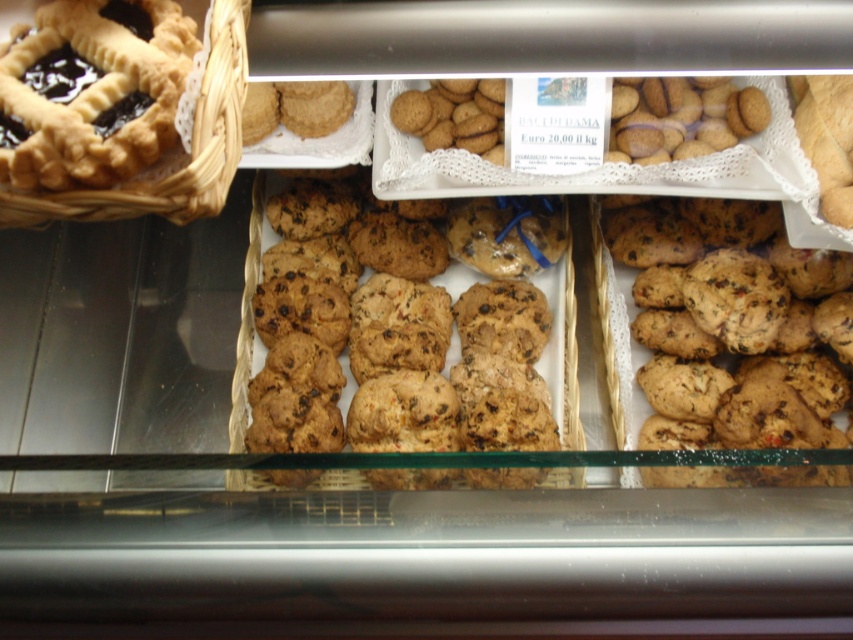
Question: Is brown crumbly cookie at center smaller than woven brown basket at upper left?

Choices:
 (A) no
 (B) yes

Answer: (A)

Question: Which of the following is the farthest from the observer?

Choices:
 (A) brown crumbly cookie at center
 (B) woven brown basket at upper left

Answer: (A)

Question: Is brown crumbly cookie at center below woven brown basket at upper left?

Choices:
 (A) yes
 (B) no

Answer: (A)

Question: Which of the following is the closest to the observer?

Choices:
 (A) brown crumbly cookie at center
 (B) woven brown basket at upper left

Answer: (B)

Question: Does brown crumbly cookie at center appear on the left side of woven brown basket at upper left?

Choices:
 (A) yes
 (B) no

Answer: (B)